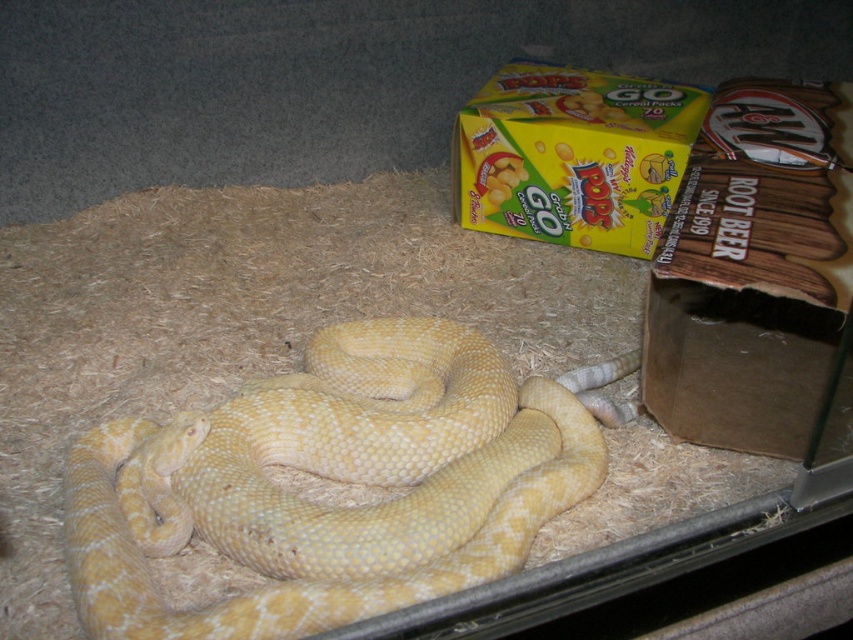
You are a zookeeper who needs to feed the yellow scaly snake at center. The feeding tool you have is 28 inches long. Can you safely reach the snake from the yellow cardboard box at upper right without extending the tool beyond its length?

The distance between the yellow scaly snake at center and the yellow cardboard box at upper right is 31.33 inches. Since the feeding tool is only 28 inches long, it is not long enough to safely reach the snake from the box. You would need a longer tool to avoid getting too close.

In the scene shown: You are a zookeeper who needs to measure the distance between the yellow scaly snake at center and the camera to ensure it is within the safe viewing range of 1 meter. Is the snake within the safe distance?

The yellow scaly snake at center is 94.12 centimeters from the camera, which is within the safe viewing range of 1 meter. Therefore, the snake is within the safe distance.

You are a zookeeper checking the enclosure. You need to place a new yellow cardboard box at upper right into the enclosure. The entrance is narrow and only allows items narrower than the current yellow scaly snake at center. Will the new box fit through the entrance?

The yellow scaly snake at center might be wider than the yellow cardboard box at upper right. Since the entrance only allows items narrower than the snake, the box may fit if it is narrower, but there is uncertainty due to the comparison being uncertain.